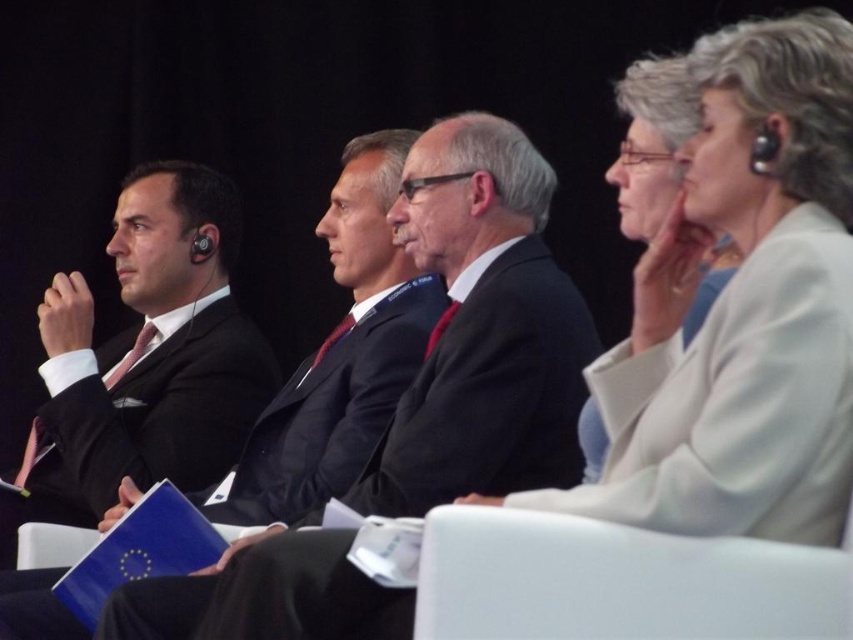
Question: Estimate the real-world distances between objects in this image. Which object is farther from the black matte suit at left?

Choices:
 (A) matte black suit at left
 (B) white plastic chair at center
 (C) matte black suit at center

Answer: (C)

Question: Can you confirm if black matte suit at left is positioned to the left of matte black suit at left?

Choices:
 (A) no
 (B) yes

Answer: (A)

Question: Which object is positioned farthest from the matte black suit at left?

Choices:
 (A) white plastic chair at center
 (B) matte black suit at center

Answer: (A)

Question: Does black matte suit at left appear over white plastic chair at center?

Choices:
 (A) no
 (B) yes

Answer: (B)

Question: Does black matte suit at left have a larger size compared to white plastic chair at center?

Choices:
 (A) no
 (B) yes

Answer: (B)

Question: Which of the following is the farthest from the observer?

Choices:
 (A) (274, 518)
 (B) (569, 436)
 (C) (708, 252)
 (D) (434, 584)

Answer: (A)